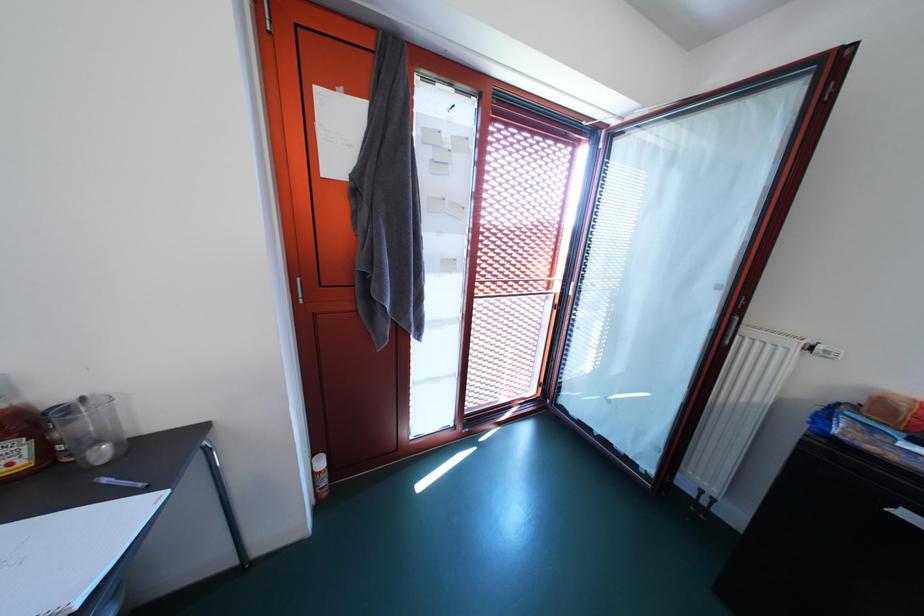
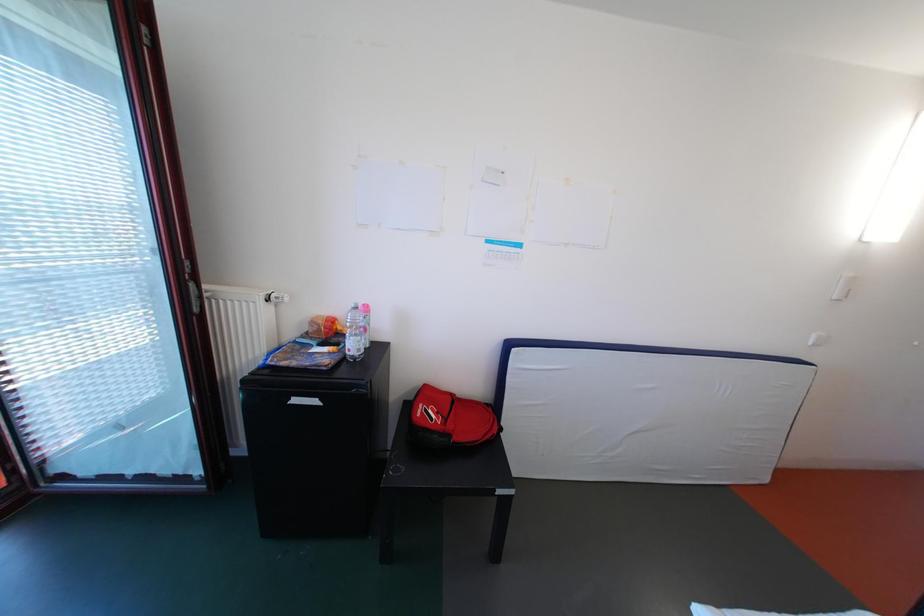
Question: The first image is from the beginning of the video and the second image is from the end. How did the camera likely rotate when shooting the video?

Choices:
 (A) Left
 (B) Right
 (C) Up
 (D) Down

Answer: (B)